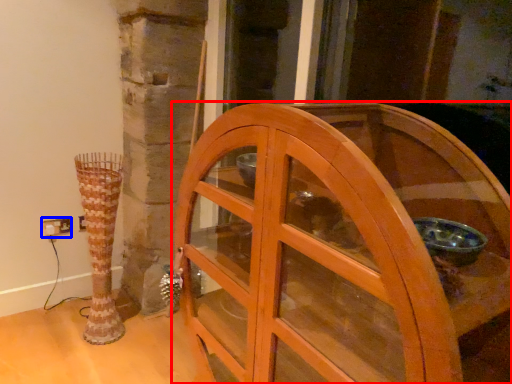
Question: Among these objects, which one is farthest to the camera, furniture (highlighted by a red box) or electric outlet (highlighted by a blue box)?

Choices:
 (A) furniture
 (B) electric outlet

Answer: (B)